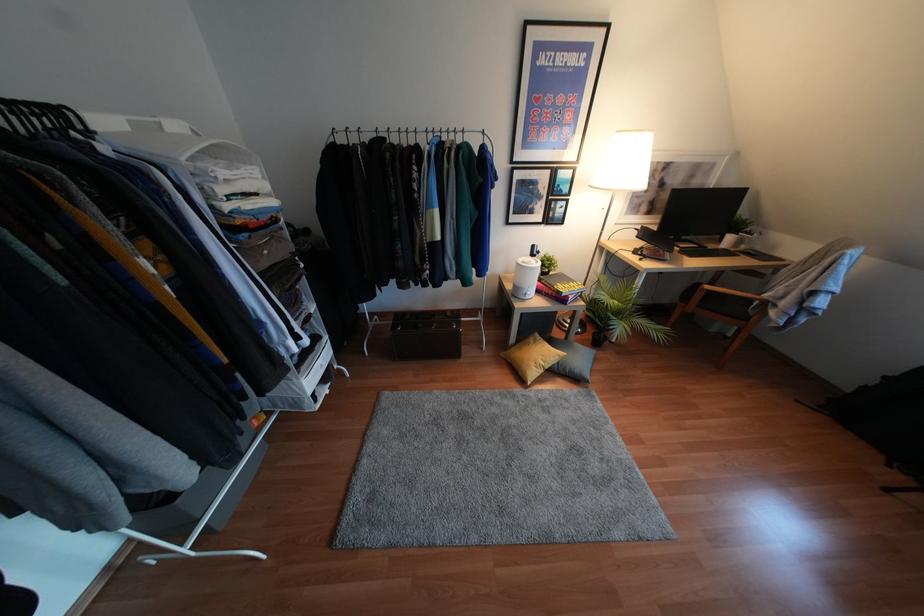
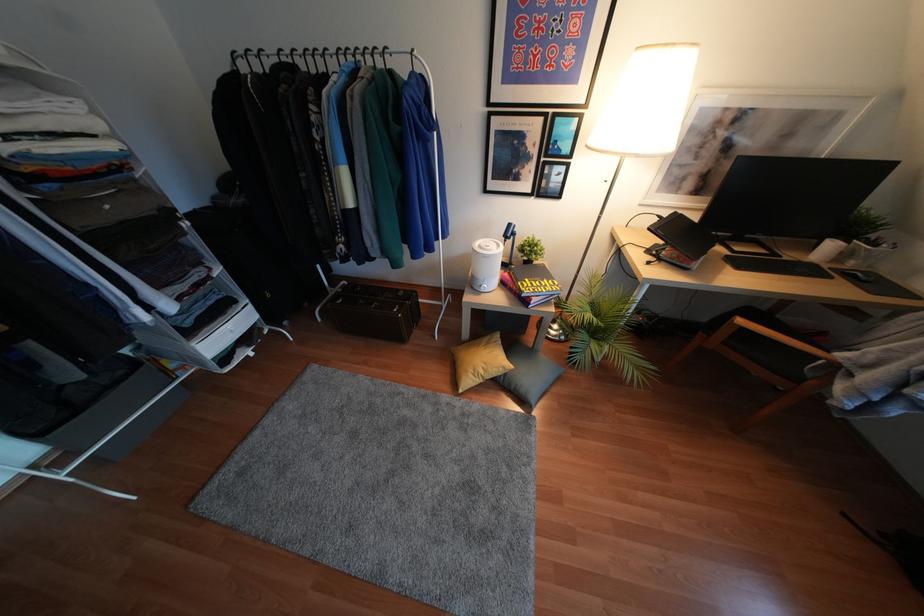
Locate, in the second image, the point that corresponds to (517,391) in the first image.

(445, 397)